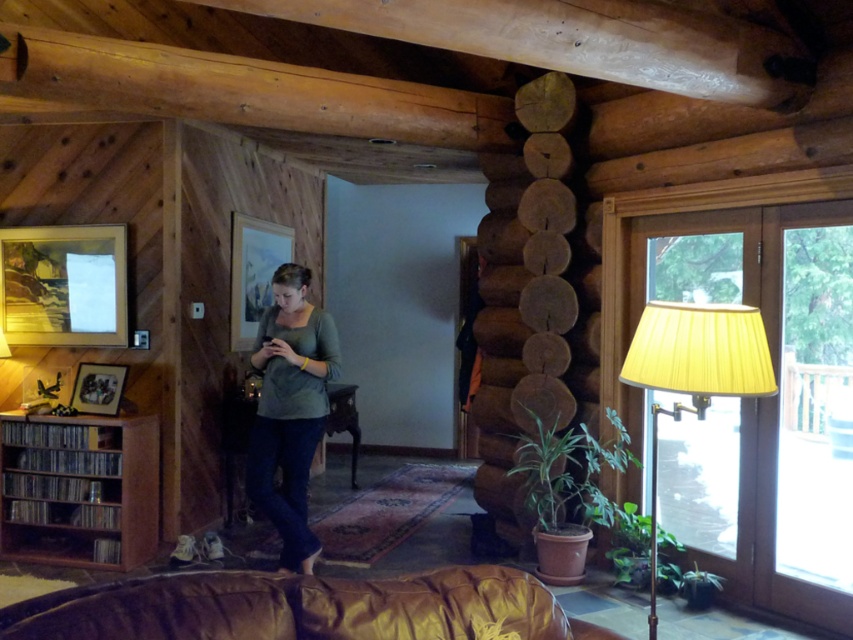
Does brown wooden bookshelf at lower left have a lesser height compared to green matte shirt at center?

Yes.

Who is positioned more to the right, brown wooden bookshelf at lower left or green matte shirt at center?

green matte shirt at center is more to the right.

Locate an element on the screen. brown wooden bookshelf at lower left is located at coordinates (78, 490).

Is point (65, 532) positioned before point (660, 317)?

No.

Identify the location of brown wooden bookshelf at lower left. This screenshot has height=640, width=853. (78, 490).

Is point (207, 595) positioned behind point (682, 339)?

No, it is not.

Is point (233, 596) in front of point (730, 332)?

Yes, it is.

Is point (167, 584) behind point (715, 340)?

That is False.

Identify the location of brown leather couch at lower center. (302, 609).